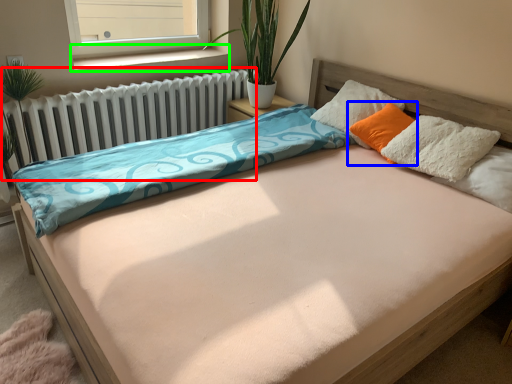
Question: Which is nearer to the radiator (highlighted by a red box)? pillow (highlighted by a blue box) or window sill (highlighted by a green box).

Choices:
 (A) pillow
 (B) window sill

Answer: (B)